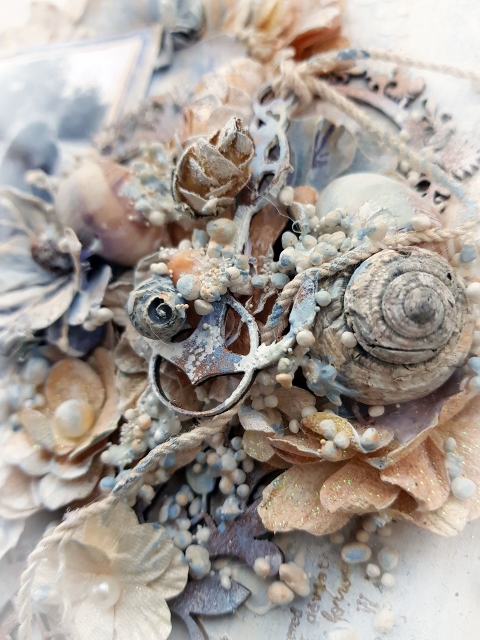
This screenshot has width=480, height=640. I want to click on white flat surface, so point(429,589), point(424,26).